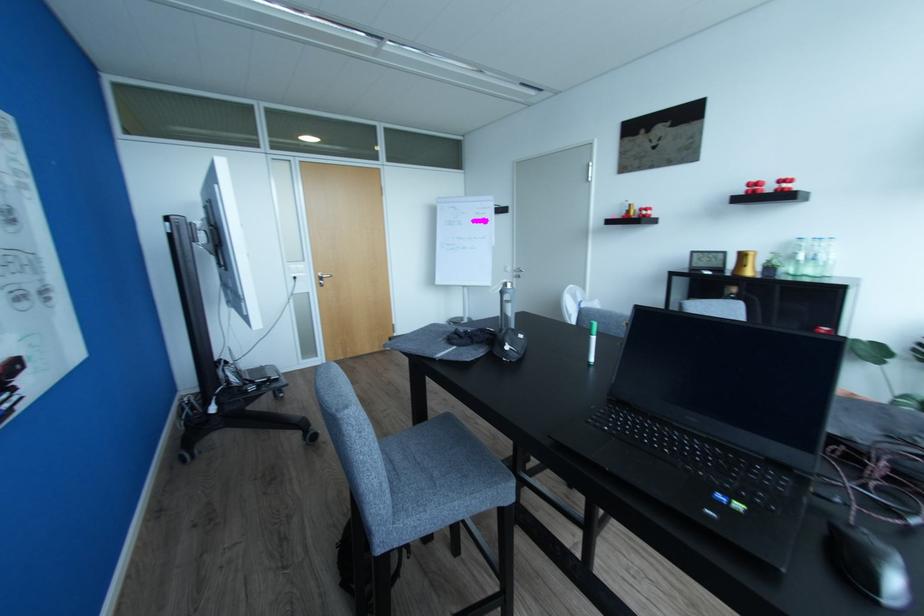
Where would you turn the wooden door handle? Please return your answer as a coordinate pair (x, y).

(322, 278)